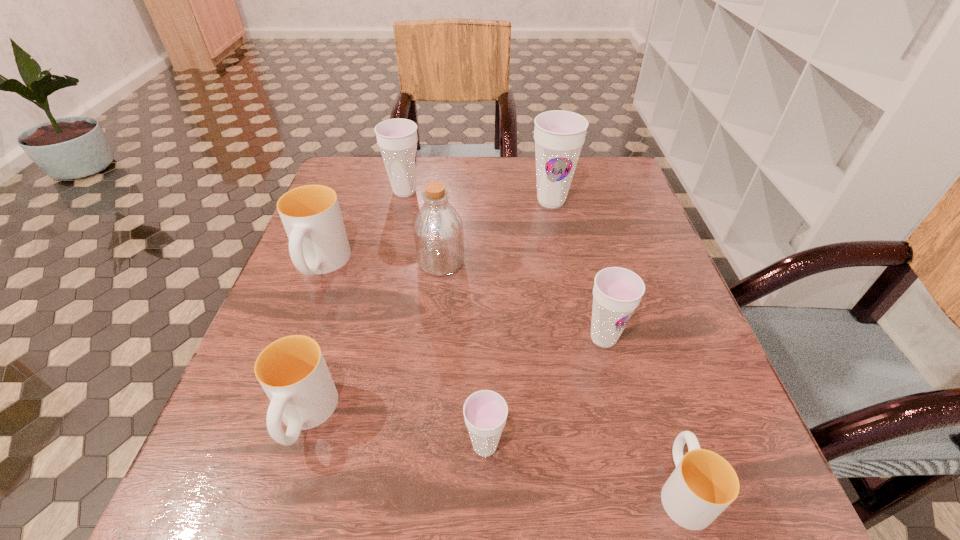
The height and width of the screenshot is (540, 960). In order to click on vacant area that lies between the shortest cup and the fourth farthest cup in this screenshot , I will do `click(643, 414)`.

The width and height of the screenshot is (960, 540). Find the location of `empty space that is in between the third farthest purple cup and the second smallest yellow cup`. empty space that is in between the third farthest purple cup and the second smallest yellow cup is located at coordinates (454, 378).

What are the coordinates of `vacant space in between the biggest yellow cup and the leftmost purple cup` in the screenshot? It's located at (363, 228).

You are a GUI agent. You are given a task and a screenshot of the screen. Output one action in this format:
    pyautogui.click(x=<x>, y=<y>)
    Task: Click on the free space between the smallest yellow cup and the second tallest cup
    The image size is (960, 540).
    Given the screenshot: What is the action you would take?
    [543, 340]

Image resolution: width=960 pixels, height=540 pixels. Find the location of `free spot between the tallest cup and the fifth object from right to left`. free spot between the tallest cup and the fifth object from right to left is located at coordinates (496, 232).

Where is `vacant space that is in between the second smallest purple cup and the shortest object`? vacant space that is in between the second smallest purple cup and the shortest object is located at coordinates [x=643, y=414].

Locate an element on the screen. free spot between the second smallest purple cup and the fifth object from right to left is located at coordinates (522, 300).

The width and height of the screenshot is (960, 540). Find the location of `free space between the second smallest yellow cup and the biggest purple cup`. free space between the second smallest yellow cup and the biggest purple cup is located at coordinates (428, 309).

Identify which object is the fifth nearest to the fifth farthest object. Please provide its 2D coordinates. Your answer should be formatted as a tuple, i.e. [(x, y)], where the tuple contains the x and y coordinates of a point satisfying the conditions above.

[(292, 371)]

At what (x,y) coordinates should I click in order to perform the action: click on object that is the fifth nearest to the second smallest yellow cup. Please return your answer as a coordinate pair (x, y). Looking at the image, I should click on [x=703, y=484].